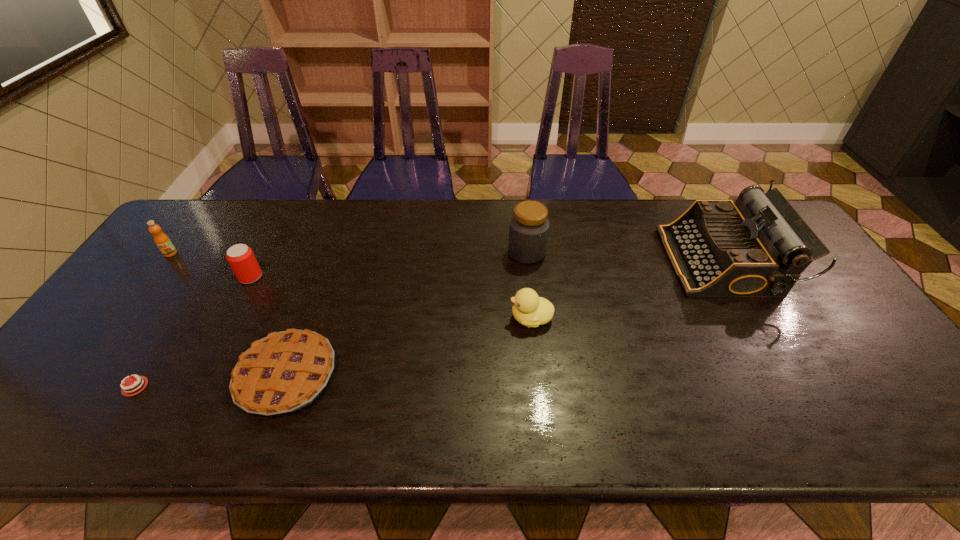
Where is `the rightmost object`? The height and width of the screenshot is (540, 960). the rightmost object is located at coordinates pos(758,246).

You are a GUI agent. You are given a task and a screenshot of the screen. Output one action in this format:
    pyautogui.click(x=<x>, y=<y>)
    Task: Click on the jar
    Image resolution: width=960 pixels, height=540 pixels.
    Given the screenshot: What is the action you would take?
    pyautogui.click(x=529, y=225)

I want to click on the leftmost object, so click(x=163, y=242).

Locate an element on the screen. the fifth object from right to left is located at coordinates (241, 258).

I want to click on duckling, so click(x=530, y=310).

Identify the location of the fourth object from left to right. The image size is (960, 540). (285, 371).

The width and height of the screenshot is (960, 540). Identify the location of pie. (285, 371).

You are a GUI agent. You are given a task and a screenshot of the screen. Output one action in this format:
    pyautogui.click(x=<x>, y=<y>)
    Task: Click on the sixth object from right to left
    
    Given the screenshot: What is the action you would take?
    pyautogui.click(x=124, y=392)

The image size is (960, 540). What are the coordinates of `the shortest object` in the screenshot? It's located at (124, 392).

Image resolution: width=960 pixels, height=540 pixels. Identify the location of free space located on the keyboard of the typewriter. (562, 261).